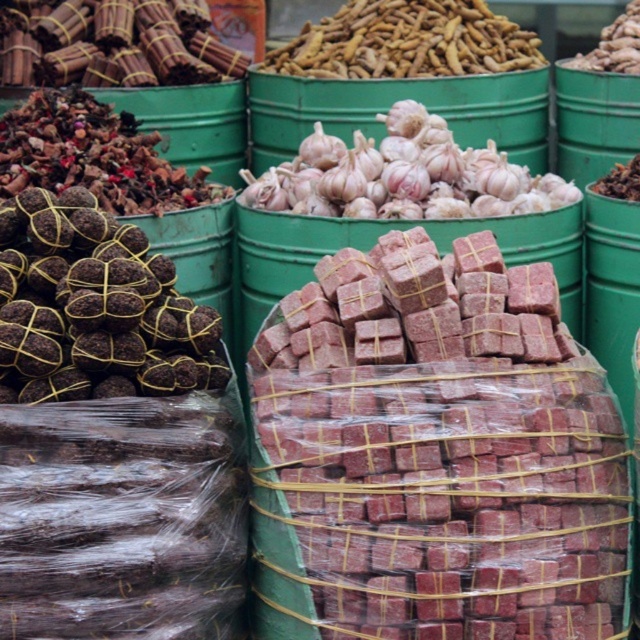
Find the location of `brown woven roots at left`. brown woven roots at left is located at coordinates (x=93, y=156).

Who is taller, brown woven roots at left or smooth brown nuts at upper center?

brown woven roots at left

Is point (204, 198) less distant than point (586, 68)?

That is True.

Find the location of `brown woven roots at left`. brown woven roots at left is located at coordinates (93, 156).

Which is in front, point (8, 269) or point (369, 64)?

Positioned in front is point (8, 269).

Which of these two, brown woven balls at left or brown textured garlic at center, stands shorter?

brown textured garlic at center

You are a GUI agent. You are given a task and a screenshot of the screen. Output one action in this format:
    pyautogui.click(x=<x>, y=<y>)
    Task: Click on the brown woven balls at left
    
    Given the screenshot: What is the action you would take?
    pyautogui.click(x=93, y=307)

Measure the distance between point (451, 520) and camera.

Point (451, 520) and camera are 12.46 feet apart.

Is red brick at center to the left of white matte garlic at center from the viewer's perspective?

No, red brick at center is not to the left of white matte garlic at center.

Is point (598, 380) closer to camera compared to point (536, 212)?

Yes, point (598, 380) is closer to viewer.

Image resolution: width=640 pixels, height=640 pixels. In order to click on red brick at center in this screenshot , I will do `click(440, 451)`.